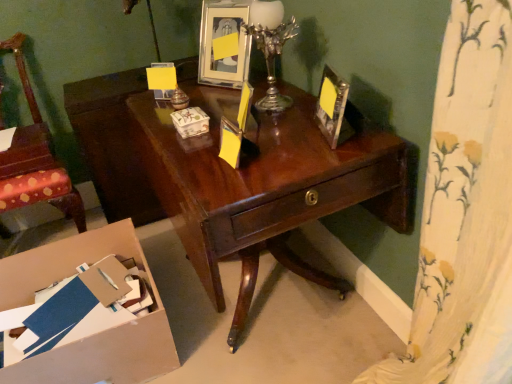
Question: Does wooden chair at left have a lesser width compared to metallic silver picture frame at upper right, arranged as the first picture frame when viewed from the right?

Choices:
 (A) no
 (B) yes

Answer: (A)

Question: Is wooden chair at left taller than metallic silver picture frame at upper right, acting as the second picture frame starting from the top?

Choices:
 (A) yes
 (B) no

Answer: (A)

Question: Is wooden chair at left far away from metallic silver picture frame at upper right, arranged as the first picture frame when viewed from the front?

Choices:
 (A) yes
 (B) no

Answer: (A)

Question: From a real-world perspective, is wooden chair at left below metallic silver picture frame at upper right, arranged as the first picture frame when viewed from the right?

Choices:
 (A) yes
 (B) no

Answer: (A)

Question: From the image's perspective, would you say wooden chair at left is shown under metallic silver picture frame at upper right, arranged as the first picture frame when viewed from the front?

Choices:
 (A) no
 (B) yes

Answer: (B)

Question: From a real-world perspective, is matte ceramic box at center positioned above or below metallic silver picture frame at upper center, placed as the first picture frame when sorted from back to front?

Choices:
 (A) above
 (B) below

Answer: (B)

Question: Is matte ceramic box at center wider or thinner than metallic silver picture frame at upper center, the first picture frame when ordered from top to bottom?

Choices:
 (A) wide
 (B) thin

Answer: (B)

Question: From the image's perspective, is matte ceramic box at center above or below metallic silver picture frame at upper center, the first picture frame when ordered from top to bottom?

Choices:
 (A) above
 (B) below

Answer: (B)

Question: In terms of height, does matte ceramic box at center look taller or shorter compared to metallic silver picture frame at upper center, the first picture frame when ordered from top to bottom?

Choices:
 (A) short
 (B) tall

Answer: (A)

Question: Based on their positions, is shiny dark wood desk at center located to the left or right of matte ceramic box at center?

Choices:
 (A) left
 (B) right

Answer: (B)

Question: Considering the positions of shiny dark wood desk at center and matte ceramic box at center in the image, is shiny dark wood desk at center bigger or smaller than matte ceramic box at center?

Choices:
 (A) big
 (B) small

Answer: (A)

Question: From a real-world perspective, is shiny dark wood desk at center physically located above or below matte ceramic box at center?

Choices:
 (A) below
 (B) above

Answer: (A)

Question: Looking at their shapes, would you say shiny dark wood desk at center is wider or thinner than matte ceramic box at center?

Choices:
 (A) thin
 (B) wide

Answer: (B)

Question: Is metallic silver picture frame at upper right, the 1th picture frame from the bottom, bigger or smaller than silver metallic candle holder at upper right?

Choices:
 (A) big
 (B) small

Answer: (B)

Question: From a real-world perspective, is metallic silver picture frame at upper right, the 1th picture frame from the bottom, physically located above or below silver metallic candle holder at upper right?

Choices:
 (A) above
 (B) below

Answer: (B)